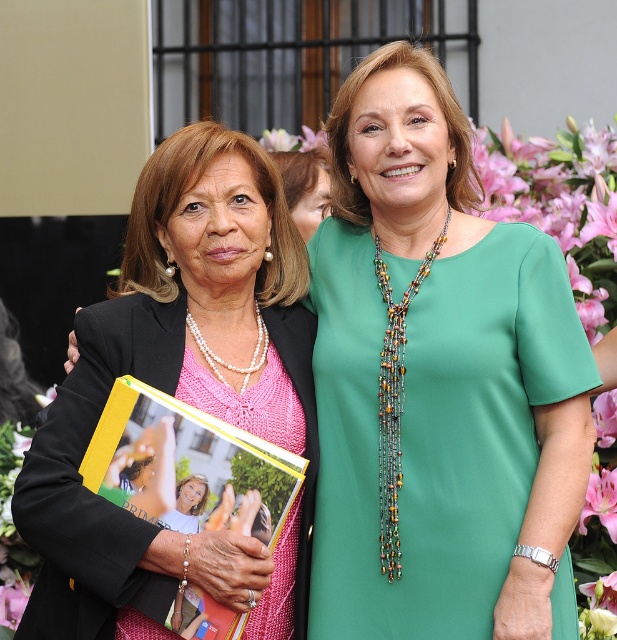
Question: Among these points, which one is farthest from the camera?

Choices:
 (A) (308, 435)
 (B) (386, 593)

Answer: (A)

Question: Is pearl necklace at center to the left of pink silk flower at upper center from the viewer's perspective?

Choices:
 (A) yes
 (B) no

Answer: (A)

Question: Which point is farther to the camera?

Choices:
 (A) pearl necklace at center
 (B) pink silk flower at upper center

Answer: (B)

Question: Is green fabric dress at center thinner than pink silk flower at upper center?

Choices:
 (A) no
 (B) yes

Answer: (A)

Question: Where is green fabric dress at center located in relation to pink silk flower at upper center in the image?

Choices:
 (A) below
 (B) above

Answer: (A)

Question: Which object is the closest to the pink silk flower at upper center?

Choices:
 (A) pearl necklace at center
 (B) green fabric dress at center

Answer: (A)